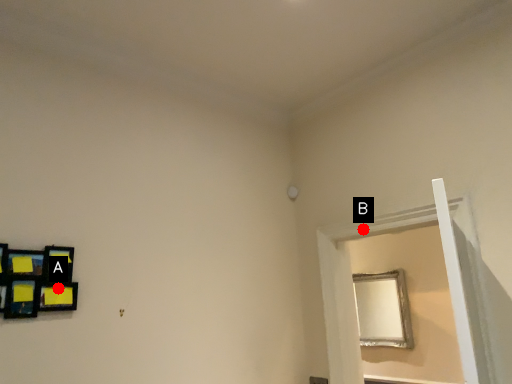
Question: Two points are circled on the image, labeled by A and B beside each circle. Which point is closer to the camera taking this photo?

Choices:
 (A) A is closer
 (B) B is closer

Answer: (A)